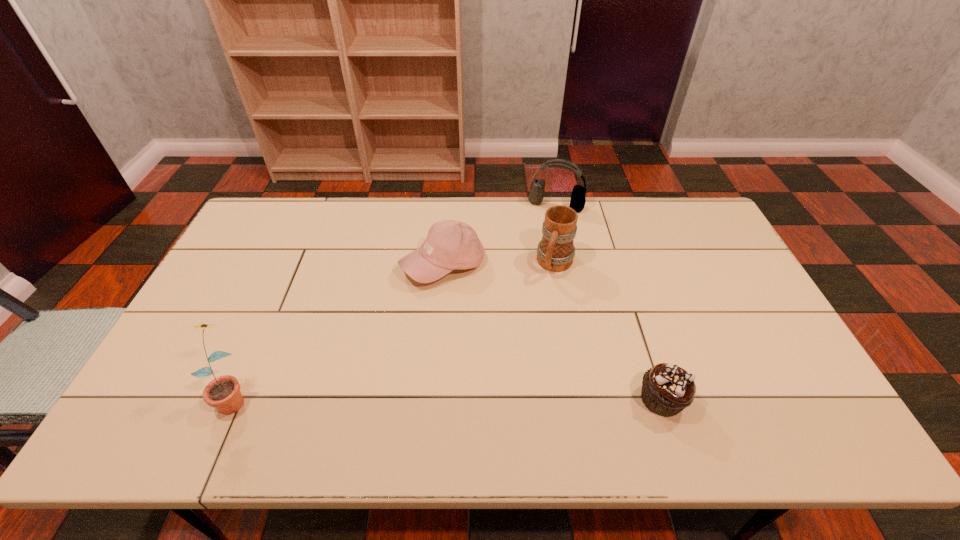
Image resolution: width=960 pixels, height=540 pixels. I want to click on sunflower, so click(x=223, y=393).

Where is `the leftmost object`? This screenshot has width=960, height=540. the leftmost object is located at coordinates (223, 393).

Where is `the shortest object`? the shortest object is located at coordinates (667, 389).

You are a GUI agent. You are given a task and a screenshot of the screen. Output one action in this format:
    pyautogui.click(x=<x>, y=<y>)
    Task: Click on the second object from left to right
    
    Given the screenshot: What is the action you would take?
    (x=450, y=245)

This screenshot has width=960, height=540. What are the coordinates of `the fourth tallest object` in the screenshot? It's located at (450, 245).

You are a GUI agent. You are given a task and a screenshot of the screen. Output one action in this format:
    pyautogui.click(x=<x>, y=<y>)
    Task: Click on the farthest object
    This screenshot has height=540, width=960.
    Given the screenshot: What is the action you would take?
    (x=577, y=202)

Where is `mug`? mug is located at coordinates (555, 252).

Locate an element on the screen. The image size is (960, 540). vacant area situated on the back of the cupcake is located at coordinates (636, 320).

You are a GUI agent. You are given a task and a screenshot of the screen. Output one action in this format:
    pyautogui.click(x=<x>, y=<y>)
    Task: Click on the free location located on the front-facing side of the baseball cap
    
    Given the screenshot: What is the action you would take?
    pyautogui.click(x=440, y=326)

Find the location of a particular element. Image resolution: width=960 pixels, height=540 pixels. vacant position located 0.340m on the front-facing side of the baseball cap is located at coordinates pos(435,393).